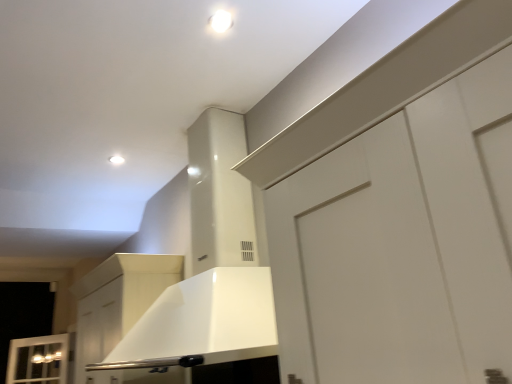
Question: In terms of height, does white glossy light fixture at upper center, which is the second lighting in right-to-left order, look taller or shorter compared to white glossy light fixture at upper center, the 2th lighting when ordered from left to right?

Choices:
 (A) short
 (B) tall

Answer: (A)

Question: From a real-world perspective, relative to white glossy light fixture at upper center, which is counted as the 1th lighting, starting from the front, is white glossy light fixture at upper center, placed as the 2th lighting when sorted from front to back, vertically above or below?

Choices:
 (A) below
 (B) above

Answer: (A)

Question: Which object is positioned farthest from the white matte cabinet at center?

Choices:
 (A) white glossy light fixture at upper center, placed as the 2th lighting when sorted from front to back
 (B) white glossy light fixture at upper center, acting as the second lighting starting from the bottom

Answer: (B)

Question: Estimate the real-world distances between objects in this image. Which object is closer to the white glossy light fixture at upper center, placed as the 2th lighting when sorted from front to back?

Choices:
 (A) white glossy light fixture at upper center, which appears as the first lighting when viewed from the right
 (B) white matte cabinet at center

Answer: (B)